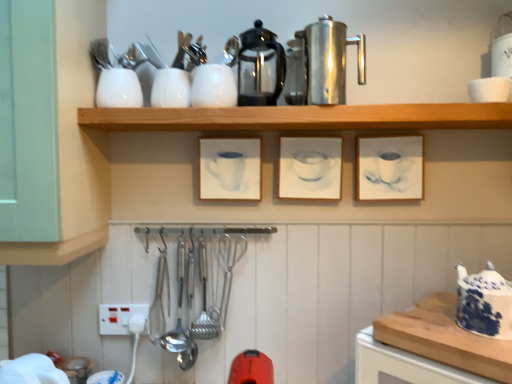
Question: Is wooden shelf at upper center facing away from white glossy vase at upper center, the third tableware from the left?

Choices:
 (A) yes
 (B) no

Answer: (B)

Question: Does wooden shelf at upper center touch white glossy vase at upper center, the second tableware viewed from the right?

Choices:
 (A) yes
 (B) no

Answer: (B)

Question: From the image's perspective, is wooden shelf at upper center above white glossy vase at upper center, the second tableware viewed from the right?

Choices:
 (A) yes
 (B) no

Answer: (B)

Question: Is wooden shelf at upper center outside white glossy vase at upper center, the third tableware from the left?

Choices:
 (A) no
 (B) yes

Answer: (B)

Question: Can you confirm if wooden shelf at upper center is bigger than white glossy vase at upper center, the second tableware viewed from the right?

Choices:
 (A) no
 (B) yes

Answer: (B)

Question: Is wooden shelf at upper center wider than white glossy vase at upper center, the third tableware from the left?

Choices:
 (A) yes
 (B) no

Answer: (A)

Question: Does blue and white ceramic teapot at right appear on the left side of white glossy cup at upper left, placed as the 1th tableware when sorted from left to right?

Choices:
 (A) no
 (B) yes

Answer: (A)

Question: From the image's perspective, is blue and white ceramic teapot at right on top of white glossy cup at upper left, positioned as the fourth tableware in right-to-left order?

Choices:
 (A) yes
 (B) no

Answer: (B)

Question: Is blue and white ceramic teapot at right next to white glossy cup at upper left, positioned as the fourth tableware in right-to-left order?

Choices:
 (A) no
 (B) yes

Answer: (A)

Question: Is blue and white ceramic teapot at right positioned with its back to white glossy cup at upper left, placed as the 1th tableware when sorted from left to right?

Choices:
 (A) yes
 (B) no

Answer: (B)

Question: Can you confirm if blue and white ceramic teapot at right is shorter than white glossy cup at upper left, positioned as the fourth tableware in right-to-left order?

Choices:
 (A) no
 (B) yes

Answer: (A)

Question: Considering the relative sizes of blue and white ceramic teapot at right and white glossy cup at upper left, positioned as the fourth tableware in right-to-left order, in the image provided, is blue and white ceramic teapot at right taller than white glossy cup at upper left, positioned as the fourth tableware in right-to-left order,?

Choices:
 (A) no
 (B) yes

Answer: (B)

Question: Considering the relative sizes of wooden cutting board at lower right and wooden shelf at upper center in the image provided, is wooden cutting board at lower right wider than wooden shelf at upper center?

Choices:
 (A) yes
 (B) no

Answer: (A)